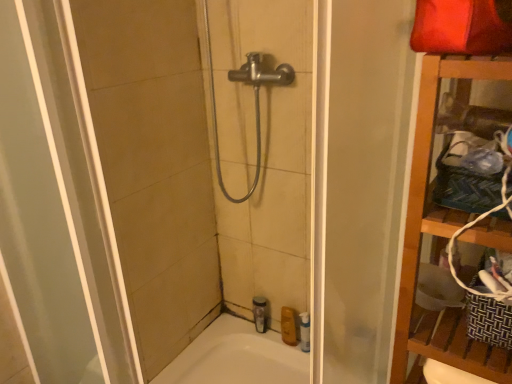
Image resolution: width=512 pixels, height=384 pixels. What are the coordinates of `yellow matte bottle at lower center, arranged as the first toiletry when viewed from the right` in the screenshot? It's located at (288, 326).

In the scene shown: Measure the distance between point (281, 322) and camera.

The depth of point (281, 322) is 6.01 feet.

At what (x,y) coordinates should I click in order to perform the action: click on white glossy bathtub at lower center. Please return your answer as a coordinate pair (x, y). Image resolution: width=512 pixels, height=384 pixels. Looking at the image, I should click on (236, 357).

Locate an element on the screen. wooden shelf at right is located at coordinates (426, 180).

What is the approximate height of transparent plastic shower door at center?

1.33 meters.

Identify the location of clear plastic bottle at lower center, the 1th toiletry from the left. This screenshot has width=512, height=384. (260, 313).

Locate an element on the screen. The image size is (512, 384). yellow matte bottle at lower center, which ranks as the 2th toiletry in left-to-right order is located at coordinates (288, 326).

Is yellow matte bottle at lower center, which ranks as the 2th toiletry in left-to-right order, taller than clear plastic bottle at lower center, the 1th toiletry from the left?

No.

In the scene shown: From a real-world perspective, who is located lower, yellow matte bottle at lower center, arranged as the first toiletry when viewed from the right, or clear plastic bottle at lower center, the 1th toiletry from the left?

In real-world perspective, yellow matte bottle at lower center, arranged as the first toiletry when viewed from the right, is lower.

Is transparent plastic shower door at center facing away from yellow matte bottle at lower center, arranged as the first toiletry when viewed from the right?

Yes.

From the image's perspective, which is below, transparent plastic shower door at center or yellow matte bottle at lower center, which ranks as the 2th toiletry in left-to-right order?

yellow matte bottle at lower center, which ranks as the 2th toiletry in left-to-right order, is shown below in the image.

Is transparent plastic shower door at center at the left side of yellow matte bottle at lower center, arranged as the first toiletry when viewed from the right?

Yes, transparent plastic shower door at center is to the left of yellow matte bottle at lower center, arranged as the first toiletry when viewed from the right.

From a real-world perspective, between wooden shelf at right and transparent plastic shower door at center, who is vertically higher?

From a 3D spatial view, transparent plastic shower door at center is above.

Is point (483, 75) behind point (197, 304)?

No, (483, 75) is in front of (197, 304).

Is wooden shelf at right inside the boundaries of transparent plastic shower door at center, or outside?

wooden shelf at right lies outside transparent plastic shower door at center.

Is wooden shelf at right positioned far away from transparent plastic shower door at center?

Actually, wooden shelf at right and transparent plastic shower door at center are a little close together.

Is white glossy bathtub at lower center facing away from clear plastic bottle at lower center, the 1th toiletry from the left?

white glossy bathtub at lower center is not turned away from clear plastic bottle at lower center, the 1th toiletry from the left.

Considering the sizes of objects white glossy bathtub at lower center and clear plastic bottle at lower center, the 1th toiletry from the left, in the image provided, who is taller, white glossy bathtub at lower center or clear plastic bottle at lower center, the 1th toiletry from the left,?

Standing taller between the two is white glossy bathtub at lower center.

From the image's perspective, is white glossy bathtub at lower center located above or below clear plastic bottle at lower center, the 1th toiletry from the left?

white glossy bathtub at lower center is below clear plastic bottle at lower center, the 1th toiletry from the left.

In the scene shown: Do you think white glossy bathtub at lower center is within clear plastic bottle at lower center, the 1th toiletry from the left, or outside of it?

white glossy bathtub at lower center is located beyond the bounds of clear plastic bottle at lower center, the 1th toiletry from the left.

Consider the image. From the image's perspective, which is above, transparent plastic shower door at center or clear plastic bottle at lower center, which is the second toiletry from right to left?

transparent plastic shower door at center is shown above in the image.

Does point (229, 279) lie in front of point (262, 331)?

No, it is behind (262, 331).

Is transparent plastic shower door at center turned away from clear plastic bottle at lower center, the 1th toiletry from the left?

Yes, clear plastic bottle at lower center, the 1th toiletry from the left, is at the back of transparent plastic shower door at center.

Considering the sizes of objects wooden shelf at right and clear plastic bottle at lower center, which is the second toiletry from right to left, in the image provided, who is smaller, wooden shelf at right or clear plastic bottle at lower center, which is the second toiletry from right to left,?

With smaller size is clear plastic bottle at lower center, which is the second toiletry from right to left.

At what (x,y) coordinates should I click in order to perform the action: click on the 1st toiletry positioned below the wooden shelf at right (from a real-world perspective). Please return your answer as a coordinate pair (x, y). Image resolution: width=512 pixels, height=384 pixels. Looking at the image, I should click on (260, 313).

Which object is thinner, wooden shelf at right or clear plastic bottle at lower center, the 1th toiletry from the left?

clear plastic bottle at lower center, the 1th toiletry from the left, is thinner.

Is point (484, 59) more distant than point (255, 320)?

No, (484, 59) is closer to viewer.

Between wooden shelf at right and yellow matte bottle at lower center, which ranks as the 2th toiletry in left-to-right order, which one appears on the left side from the viewer's perspective?

Positioned to the left is yellow matte bottle at lower center, which ranks as the 2th toiletry in left-to-right order.

There is a wooden shelf at right. Where is `the 2nd toiletry below it (from a real-world perspective)`? the 2nd toiletry below it (from a real-world perspective) is located at coordinates (288, 326).

From a real-world perspective, which object stands above the other?

In real-world perspective, wooden shelf at right is above.

How far apart are wooden shelf at right and yellow matte bottle at lower center, which ranks as the 2th toiletry in left-to-right order?

The distance of wooden shelf at right from yellow matte bottle at lower center, which ranks as the 2th toiletry in left-to-right order, is 38.36 inches.

This screenshot has height=384, width=512. In the image, there is a clear plastic bottle at lower center, the 1th toiletry from the left. What are the coordinates of `toiletry below it (from the image's perspective)` in the screenshot? It's located at (288, 326).

You are a GUI agent. You are given a task and a screenshot of the screen. Output one action in this format:
    pyautogui.click(x=<x>, y=<y>)
    Task: Click on the toiletry that is the 2nd one when counting rightward from the transparent plastic shower door at center
    The image size is (512, 384).
    Given the screenshot: What is the action you would take?
    pyautogui.click(x=288, y=326)

Based on the photo, which object lies further to the anchor point wooden shelf at right, white glossy bathtub at lower center or clear plastic bottle at lower center, which is the second toiletry from right to left?

The object further to wooden shelf at right is clear plastic bottle at lower center, which is the second toiletry from right to left.

From the picture: Which object lies nearer to the anchor point white glossy bathtub at lower center, transparent plastic shower door at center or wooden shelf at right?

transparent plastic shower door at center is positioned closer to the anchor white glossy bathtub at lower center.

Looking at the image, which one is located further to yellow matte bottle at lower center, which ranks as the 2th toiletry in left-to-right order, clear plastic bottle at lower center, the 1th toiletry from the left, or wooden shelf at right?

Among the two, wooden shelf at right is located further to yellow matte bottle at lower center, which ranks as the 2th toiletry in left-to-right order.

In the scene shown: Based on their spatial positions, is white glossy bathtub at lower center or yellow matte bottle at lower center, which ranks as the 2th toiletry in left-to-right order, further from transparent plastic shower door at center?

yellow matte bottle at lower center, which ranks as the 2th toiletry in left-to-right order, is positioned further to the anchor transparent plastic shower door at center.

Estimate the real-world distances between objects in this image. Which object is further from white glossy bathtub at lower center, yellow matte bottle at lower center, which ranks as the 2th toiletry in left-to-right order, or clear plastic bottle at lower center, which is the second toiletry from right to left?

yellow matte bottle at lower center, which ranks as the 2th toiletry in left-to-right order, is further to white glossy bathtub at lower center.

Looking at the image, which one is located closer to transparent plastic shower door at center, clear plastic bottle at lower center, which is the second toiletry from right to left, or wooden shelf at right?

Based on the image, clear plastic bottle at lower center, which is the second toiletry from right to left, appears to be nearer to transparent plastic shower door at center.

In the scene shown: Which object lies further to the anchor point white glossy bathtub at lower center, wooden shelf at right or clear plastic bottle at lower center, which is the second toiletry from right to left?

The object further to white glossy bathtub at lower center is wooden shelf at right.

From the image, which object appears to be farther from transparent plastic shower door at center, yellow matte bottle at lower center, which ranks as the 2th toiletry in left-to-right order, or clear plastic bottle at lower center, which is the second toiletry from right to left?

Based on the image, yellow matte bottle at lower center, which ranks as the 2th toiletry in left-to-right order, appears to be further to transparent plastic shower door at center.

You are a GUI agent. You are given a task and a screenshot of the screen. Output one action in this format:
    pyautogui.click(x=<x>, y=<y>)
    Task: Click on the bathtub positioned between transparent plastic shower door at center and yellow matte bottle at lower center, which ranks as the 2th toiletry in left-to-right order, from near to far
    The width and height of the screenshot is (512, 384).
    Given the screenshot: What is the action you would take?
    pos(236,357)

This screenshot has width=512, height=384. Find the location of `furniture located between transparent plastic shower door at center and yellow matte bottle at lower center, which ranks as the 2th toiletry in left-to-right order, in the depth direction`. furniture located between transparent plastic shower door at center and yellow matte bottle at lower center, which ranks as the 2th toiletry in left-to-right order, in the depth direction is located at coordinates (426, 180).

Identify the location of toiletry between transparent plastic shower door at center and clear plastic bottle at lower center, which is the second toiletry from right to left, from front to back. This screenshot has width=512, height=384. (288, 326).

Image resolution: width=512 pixels, height=384 pixels. Find the location of `toiletry between white glossy bathtub at lower center and clear plastic bottle at lower center, the 1th toiletry from the left, in the front-back direction`. toiletry between white glossy bathtub at lower center and clear plastic bottle at lower center, the 1th toiletry from the left, in the front-back direction is located at coordinates (288, 326).